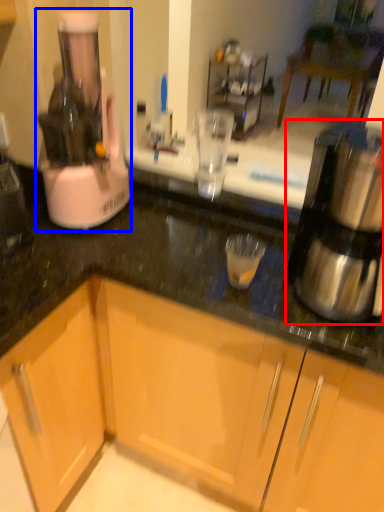
Question: Which point is closer to the camera, kitchen appliance (highlighted by a red box) or home appliance (highlighted by a blue box)?

Choices:
 (A) kitchen appliance
 (B) home appliance

Answer: (A)